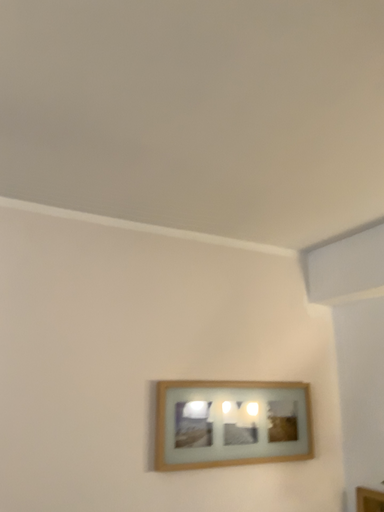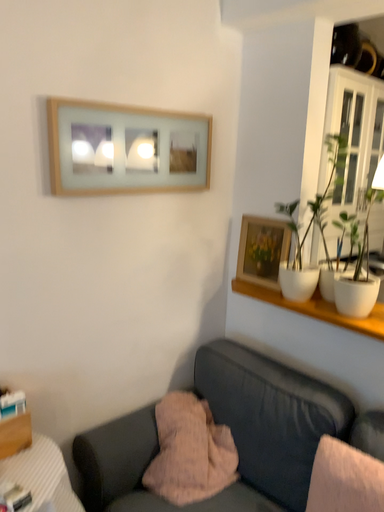
Question: Which way did the camera rotate in the video?

Choices:
 (A) rotated downward
 (B) rotated upward

Answer: (A)